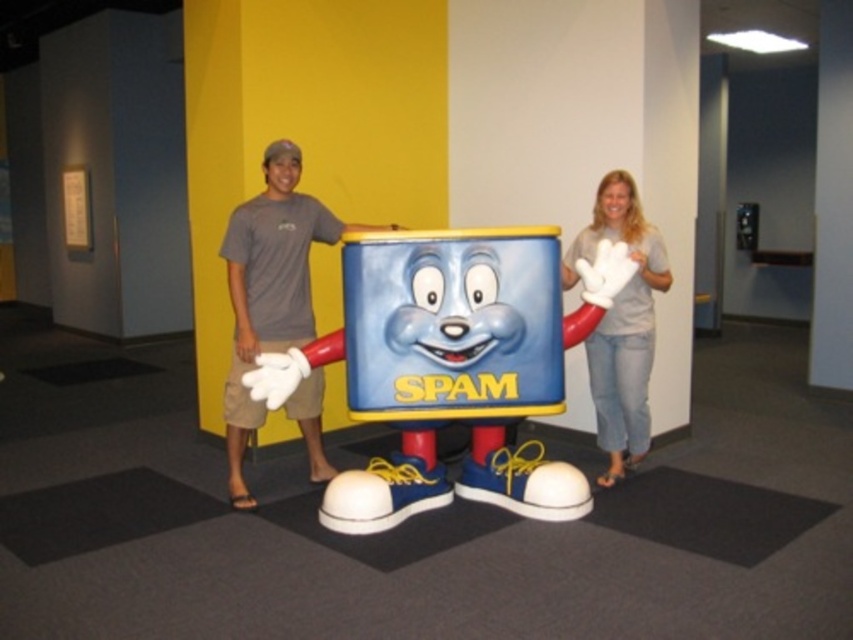
Question: Which object appears closest to the camera in this image?

Choices:
 (A) matte plastic spam can at center
 (B) light brown denim jeans at right
 (C) gray cotton t-shirt at center

Answer: (A)

Question: Among these objects, which one is farthest from the camera?

Choices:
 (A) matte plastic spam can at center
 (B) light brown denim jeans at right
 (C) gray cotton t-shirt at center

Answer: (C)

Question: Can you confirm if matte plastic spam can at center is positioned above light brown denim jeans at right?

Choices:
 (A) yes
 (B) no

Answer: (B)

Question: Can you confirm if matte plastic spam can at center is thinner than light brown denim jeans at right?

Choices:
 (A) no
 (B) yes

Answer: (A)

Question: Which point is closer to the camera?

Choices:
 (A) matte plastic spam can at center
 (B) light brown denim jeans at right

Answer: (A)

Question: Does matte plastic spam can at center have a greater width compared to light brown denim jeans at right?

Choices:
 (A) no
 (B) yes

Answer: (B)